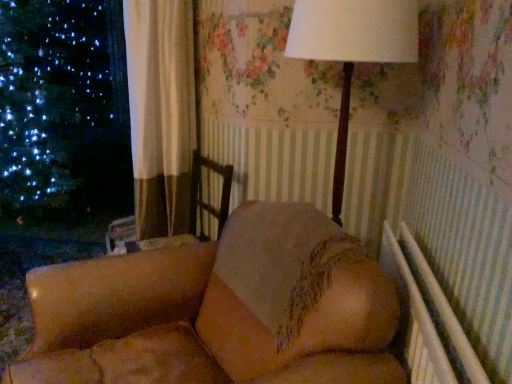
Question: Looking at their shapes, would you say matte brown lamp at upper center is wider or thinner than velvet beige sofa at center?

Choices:
 (A) wide
 (B) thin

Answer: (B)

Question: Does point (309, 3) appear closer or farther from the camera than point (62, 279)?

Choices:
 (A) closer
 (B) farther

Answer: (A)

Question: Is matte brown lamp at upper center taller or shorter than velvet beige sofa at center?

Choices:
 (A) tall
 (B) short

Answer: (A)

Question: Looking at their shapes, would you say velvet beige sofa at center is wider or thinner than matte brown lamp at upper center?

Choices:
 (A) wide
 (B) thin

Answer: (A)

Question: Which is correct: velvet beige sofa at center is inside matte brown lamp at upper center, or outside of it?

Choices:
 (A) inside
 (B) outside

Answer: (B)

Question: Does point (217, 326) appear closer or farther from the camera than point (377, 33)?

Choices:
 (A) farther
 (B) closer

Answer: (A)

Question: Considering the positions of velvet beige sofa at center and matte brown lamp at upper center in the image, is velvet beige sofa at center taller or shorter than matte brown lamp at upper center?

Choices:
 (A) tall
 (B) short

Answer: (B)